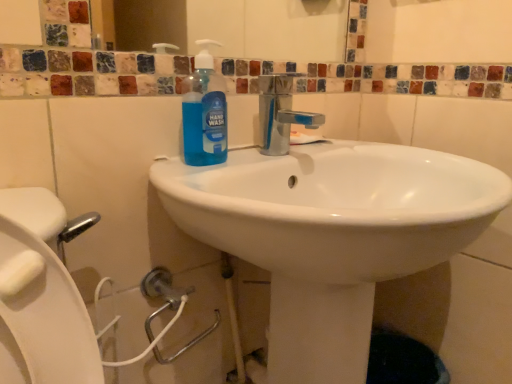
Question: From a real-world perspective, is blue translucent hand wash at center positioned above or below white glossy sink at center?

Choices:
 (A) above
 (B) below

Answer: (A)

Question: Is blue translucent hand wash at center bigger or smaller than white glossy sink at center?

Choices:
 (A) big
 (B) small

Answer: (B)

Question: From the image's perspective, relative to white glossy sink at center, is blue translucent hand wash at center above or below?

Choices:
 (A) below
 (B) above

Answer: (B)

Question: Is white glossy sink at center situated inside blue translucent hand wash at center or outside?

Choices:
 (A) inside
 (B) outside

Answer: (B)

Question: Is white glossy sink at center bigger or smaller than blue translucent hand wash at center?

Choices:
 (A) big
 (B) small

Answer: (A)

Question: From a real-world perspective, is white glossy sink at center above or below blue translucent hand wash at center?

Choices:
 (A) above
 (B) below

Answer: (B)

Question: Based on their positions, is white glossy sink at center located to the left or right of blue translucent hand wash at center?

Choices:
 (A) right
 (B) left

Answer: (A)